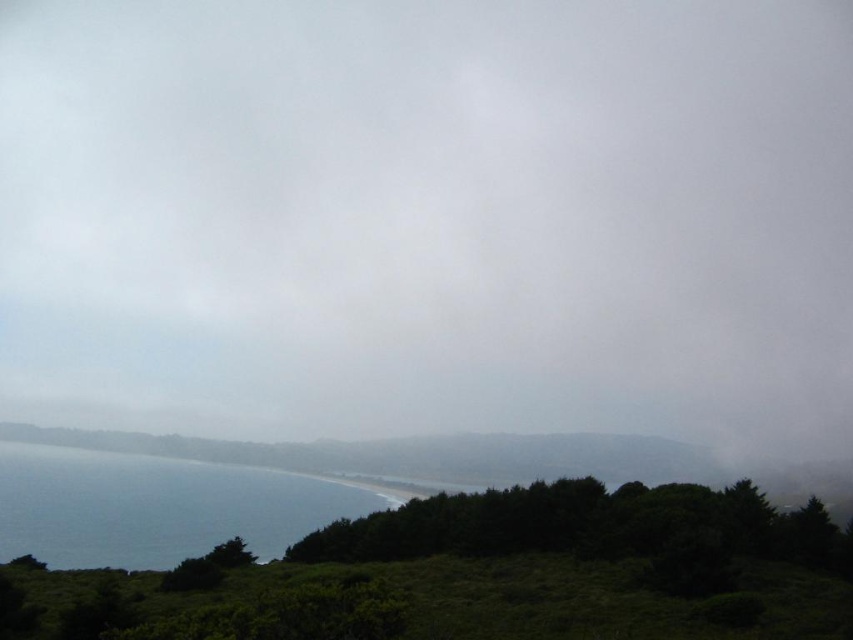
Question: Which point is farther to the camera?

Choices:
 (A) (134, 324)
 (B) (325, 493)

Answer: (A)

Question: Can you confirm if white fluffy cloud at upper center is positioned below blue water at lower left?

Choices:
 (A) yes
 (B) no

Answer: (B)

Question: Is white fluffy cloud at upper center positioned before blue water at lower left?

Choices:
 (A) no
 (B) yes

Answer: (A)

Question: Which object appears farthest from the camera in this image?

Choices:
 (A) white fluffy cloud at upper center
 (B) blue water at lower left

Answer: (A)

Question: Does white fluffy cloud at upper center appear on the left side of blue water at lower left?

Choices:
 (A) yes
 (B) no

Answer: (B)

Question: Which point is closer to the camera?

Choices:
 (A) blue water at lower left
 (B) white fluffy cloud at upper center

Answer: (A)